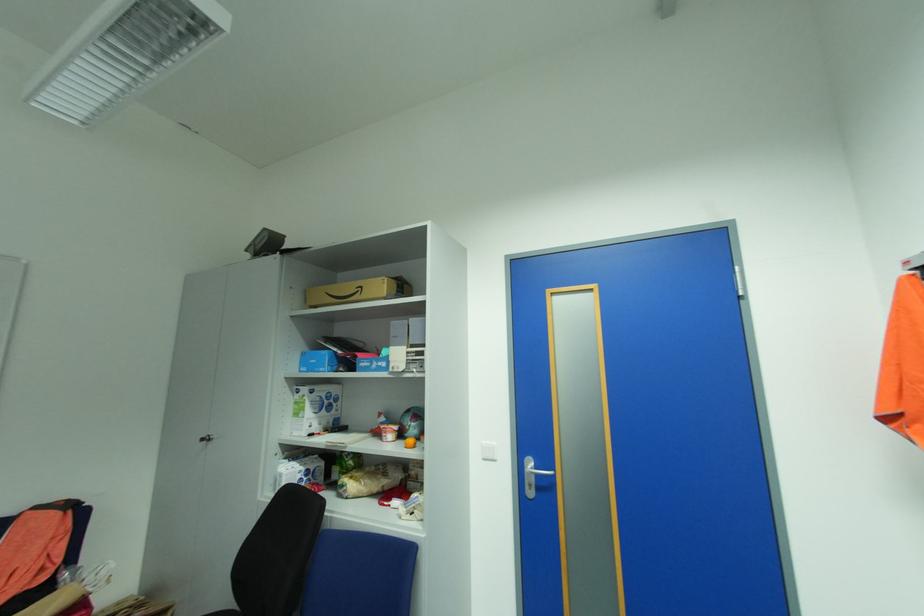
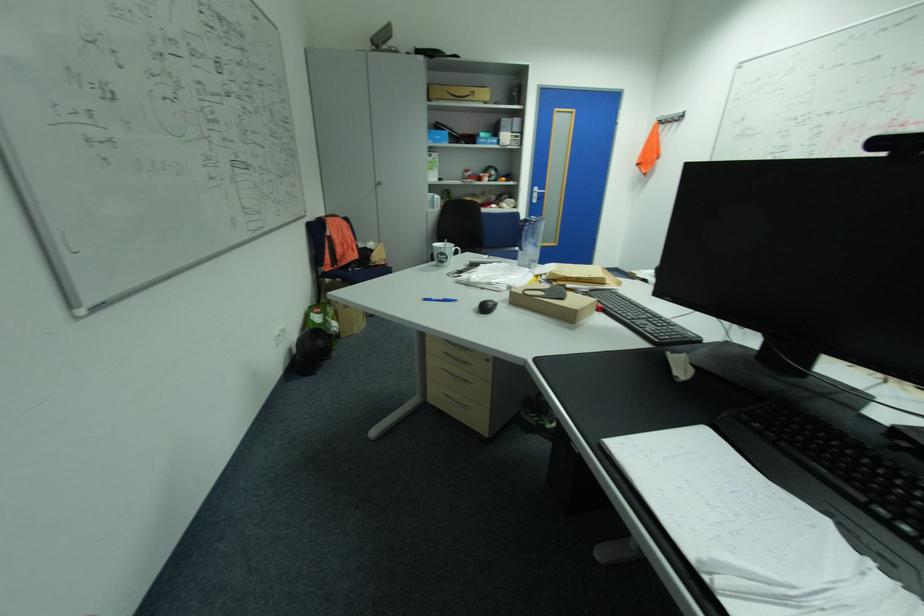
Locate, in the second image, the point that corresponds to point (543, 475) in the first image.

(544, 193)